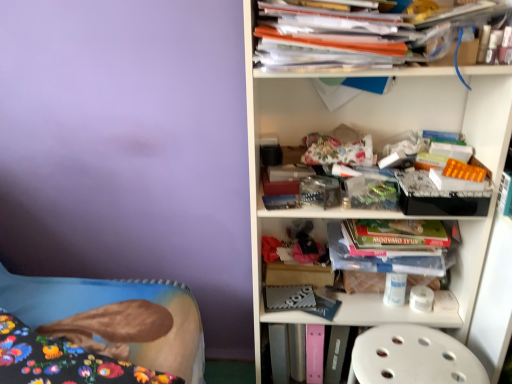
Question: From a real-world perspective, is fluffy fabric bed at lower left physically below white plastic shelf at upper right, acting as the 2th shelf starting from the bottom?

Choices:
 (A) no
 (B) yes

Answer: (B)

Question: Does fluffy fabric bed at lower left have a larger size compared to white plastic shelf at upper right, which ranks as the first shelf in top-to-bottom order?

Choices:
 (A) no
 (B) yes

Answer: (A)

Question: Is the depth of fluffy fabric bed at lower left less than that of white plastic shelf at upper right, which ranks as the first shelf in top-to-bottom order?

Choices:
 (A) yes
 (B) no

Answer: (A)

Question: From the image's perspective, is fluffy fabric bed at lower left on white plastic shelf at upper right, which ranks as the first shelf in top-to-bottom order?

Choices:
 (A) yes
 (B) no

Answer: (B)

Question: Is fluffy fabric bed at lower left not near white plastic shelf at upper right, which ranks as the first shelf in top-to-bottom order?

Choices:
 (A) yes
 (B) no

Answer: (B)

Question: From the image's perspective, is translucent plastic container at center, arranged as the 2th shelf when viewed from the top, positioned above or below orange plastic folder at upper right?

Choices:
 (A) below
 (B) above

Answer: (A)

Question: Based on their positions, is translucent plastic container at center, arranged as the 2th shelf when viewed from the top, located to the left or right of orange plastic folder at upper right?

Choices:
 (A) left
 (B) right

Answer: (B)

Question: Is translucent plastic container at center, placed as the 1th shelf when sorted from bottom to top, wider or thinner than orange plastic folder at upper right?

Choices:
 (A) wide
 (B) thin

Answer: (B)

Question: Is translucent plastic container at center, arranged as the 2th shelf when viewed from the top, bigger or smaller than orange plastic folder at upper right?

Choices:
 (A) big
 (B) small

Answer: (A)

Question: In terms of height, does fluffy fabric bed at lower left look taller or shorter compared to orange plastic folder at upper right?

Choices:
 (A) tall
 (B) short

Answer: (B)

Question: Relative to orange plastic folder at upper right, is fluffy fabric bed at lower left in front or behind?

Choices:
 (A) front
 (B) behind

Answer: (A)

Question: Considering the positions of fluffy fabric bed at lower left and orange plastic folder at upper right in the image, is fluffy fabric bed at lower left wider or thinner than orange plastic folder at upper right?

Choices:
 (A) wide
 (B) thin

Answer: (A)

Question: Considering the positions of point (180, 302) and point (391, 34), is point (180, 302) closer or farther from the camera than point (391, 34)?

Choices:
 (A) farther
 (B) closer

Answer: (A)

Question: Considering their positions, is translucent plastic container at center, arranged as the 2th shelf when viewed from the top, located in front of or behind white plastic step stool at lower right?

Choices:
 (A) front
 (B) behind

Answer: (B)

Question: Based on their positions, is translucent plastic container at center, arranged as the 2th shelf when viewed from the top, located to the left or right of white plastic step stool at lower right?

Choices:
 (A) right
 (B) left

Answer: (B)